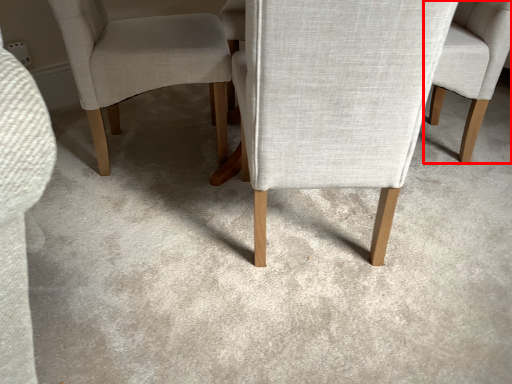
Question: From the image's perspective, what is the correct spatial positioning of chair (annotated by the red box) in reference to chair?

Choices:
 (A) above
 (B) below

Answer: (A)